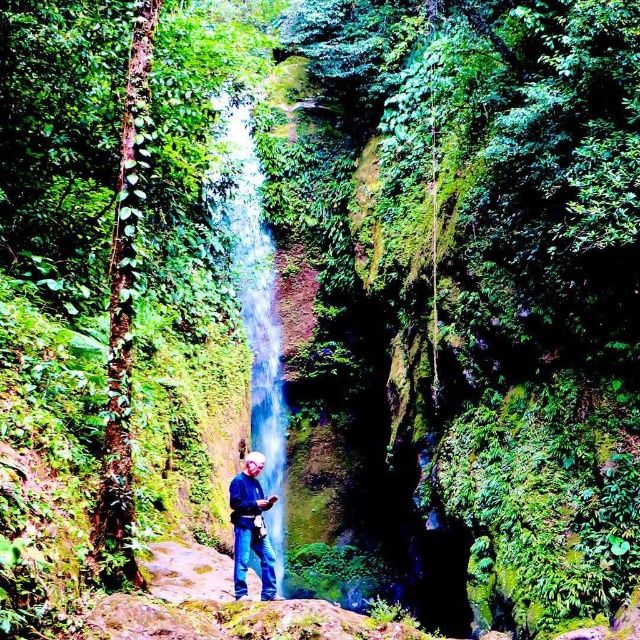
Question: Which point appears closest to the camera in this image?

Choices:
 (A) (252, 490)
 (B) (234, 115)

Answer: (A)

Question: Which of the following is the closest to the observer?

Choices:
 (A) blue jeans at lower center
 (B) translucent glass waterfall at center

Answer: (A)

Question: Which object appears farthest from the camera in this image?

Choices:
 (A) translucent glass waterfall at center
 (B) blue jeans at lower center

Answer: (A)

Question: Is translucent glass waterfall at center below blue jeans at lower center?

Choices:
 (A) yes
 (B) no

Answer: (B)

Question: Is translucent glass waterfall at center below blue jeans at lower center?

Choices:
 (A) yes
 (B) no

Answer: (B)

Question: Considering the relative positions of translucent glass waterfall at center and blue jeans at lower center in the image provided, where is translucent glass waterfall at center located with respect to blue jeans at lower center?

Choices:
 (A) below
 (B) above

Answer: (B)